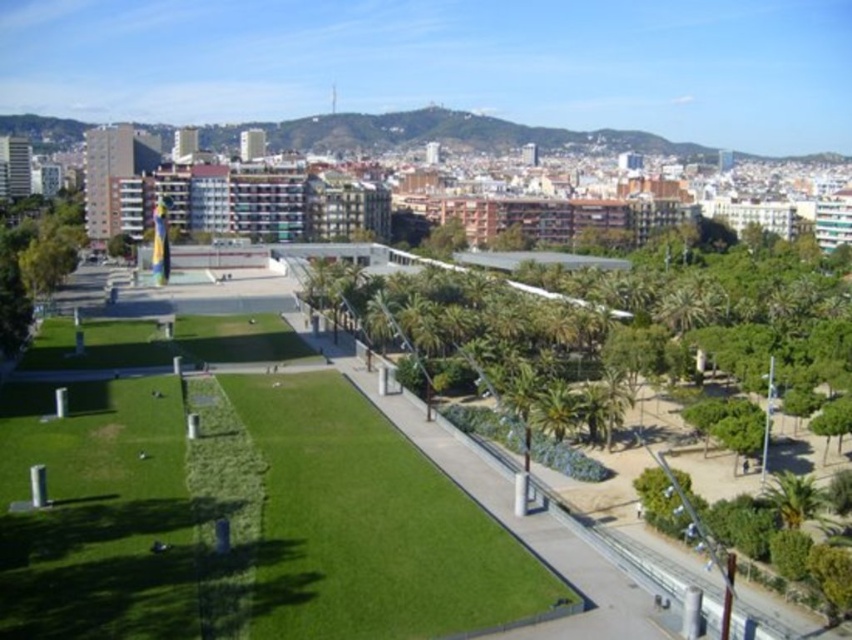
Question: Among these objects, which one is nearest to the camera?

Choices:
 (A) green leafy tree at center
 (B) green leafy tree at left
 (C) green grass at center

Answer: (C)

Question: Can you confirm if green leafy tree at center is thinner than green leafy tree at left?

Choices:
 (A) no
 (B) yes

Answer: (B)

Question: Which is nearer to the green leafy tree at center?

Choices:
 (A) green grass at center
 (B) green leafy tree at left

Answer: (A)

Question: Does green leafy tree at center have a greater width compared to green leafy tree at left?

Choices:
 (A) no
 (B) yes

Answer: (A)

Question: Which of the following is the closest to the observer?

Choices:
 (A) (384, 320)
 (B) (81, 225)

Answer: (A)

Question: Is green grass at center positioned before green leafy tree at center?

Choices:
 (A) no
 (B) yes

Answer: (B)